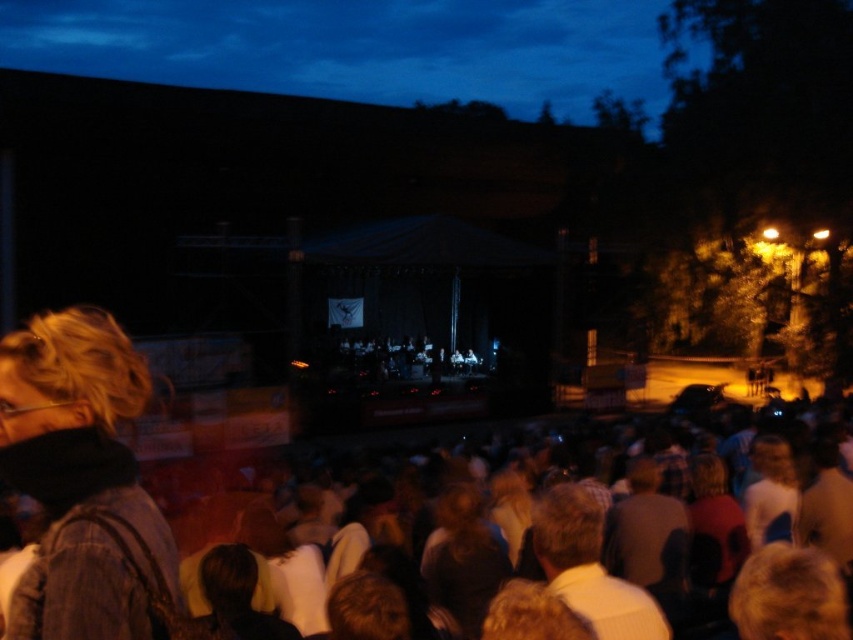
You are a photographer trying to capture a clear shot of the light brown hair at center and the denim jacket at lower left. Which object should you focus on first if you want to ensure both are in focus without adjusting your camera settings?

The denim jacket at lower left has a greater height compared to light brown hair at center, so you should focus on the denim jacket at lower left first to ensure both are in focus.

You are standing at the point labeled point (97, 442) and want to walk to the stage. There is an obstacle at point (759, 522) blocking your path. Can you go around it by moving towards the front of the obstacle?

Yes, you can go around the obstacle at point (759, 522) by moving towards its front because point (97, 442) is already in front of the obstacle, so you can proceed directly to the stage without needing to go around.

You are a photographer at the event and want to capture a photo that includes both the white cotton shirt at center and the light brown hair at center. Based on their positions, which one should you focus on first to ensure both are in frame?

The white cotton shirt at center is to the left of the light brown hair at center, so you should focus on the light brown hair at center first to ensure both are in frame.